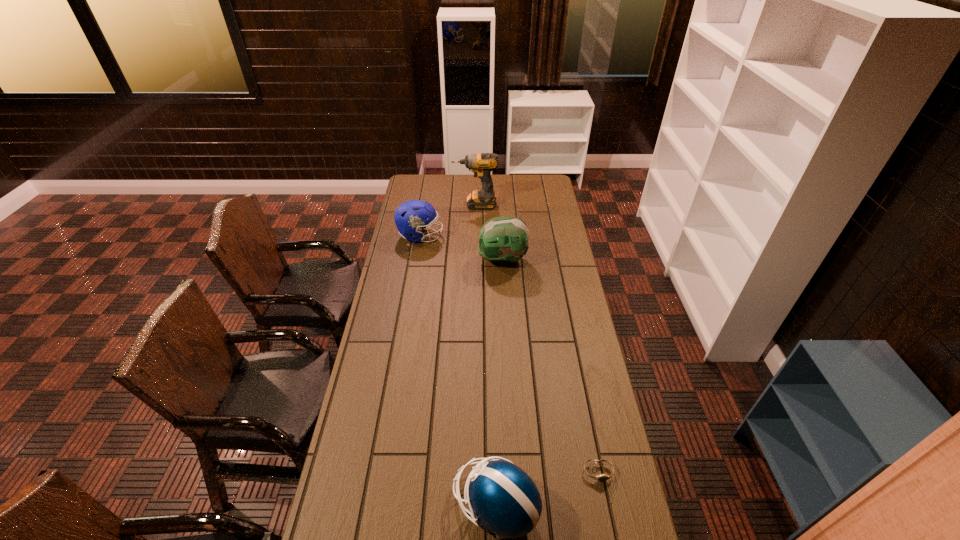
Identify the location of blank area located 0.170m on the visor of the third farthest object. This screenshot has height=540, width=960. 442,260.

Where is `vacant space located on the visor of the third farthest object`? This screenshot has width=960, height=540. vacant space located on the visor of the third farthest object is located at coordinates (425, 260).

Where is `vacant space positioned 0.110m on the visor of the third farthest object`? The height and width of the screenshot is (540, 960). vacant space positioned 0.110m on the visor of the third farthest object is located at coordinates (454, 260).

The image size is (960, 540). I want to click on vacant point located 0.200m on the face guard of the farthest football helmet, so click(x=483, y=236).

You are a GUI agent. You are given a task and a screenshot of the screen. Output one action in this format:
    pyautogui.click(x=<x>, y=<y>)
    Task: Click on the vacant area situated 0.110m on the face of the shortest object
    The width and height of the screenshot is (960, 540).
    Given the screenshot: What is the action you would take?
    pyautogui.click(x=608, y=521)

Where is `object present at the left edge`? object present at the left edge is located at coordinates (413, 216).

The image size is (960, 540). I want to click on object that is positioned at the right edge, so click(603, 477).

Find the location of `vacant region at the far edge of the desktop`. vacant region at the far edge of the desktop is located at coordinates (521, 191).

Locate an element on the screen. Image resolution: width=960 pixels, height=540 pixels. vacant space at the left edge is located at coordinates (368, 372).

In the image, there is a desktop. Where is `free region at the right edge`? This screenshot has width=960, height=540. free region at the right edge is located at coordinates (550, 314).